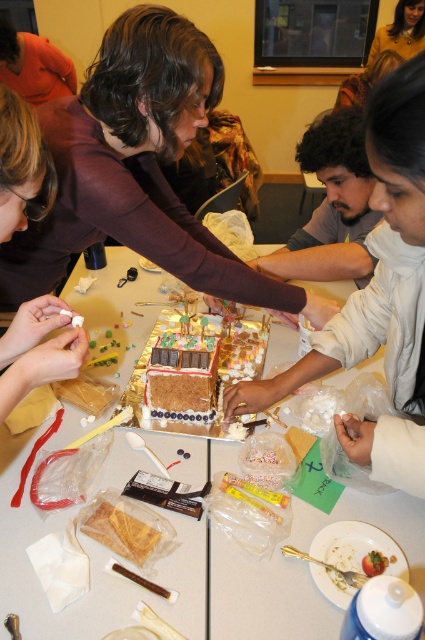
Does dark curly hair at center have a greater width compared to brown woolen sweater at upper center?

No, dark curly hair at center is not wider than brown woolen sweater at upper center.

Does dark curly hair at center have a smaller size compared to brown woolen sweater at upper center?

Actually, dark curly hair at center might be larger than brown woolen sweater at upper center.

Identify the location of dark curly hair at center. Image resolution: width=425 pixels, height=640 pixels. (331, 205).

At what (x,y) coordinates should I click in order to perform the action: click on dark curly hair at center. Please return your answer as a coordinate pair (x, y). The image size is (425, 640). Looking at the image, I should click on (331, 205).

Is matte white marshmallow at center below dark curly hair at center?

Correct, matte white marshmallow at center is located below dark curly hair at center.

In order to click on matte white marshmallow at center in this screenshot , I will do `click(37, 349)`.

Describe the element at coordinates (37, 349) in the screenshot. I see `matte white marshmallow at center` at that location.

Where is `matte white marshmallow at center`? Image resolution: width=425 pixels, height=640 pixels. matte white marshmallow at center is located at coordinates (37, 349).

Is white plastic table at center taller than candy-coated chocolate cake at center?

Yes.

Between point (3, 513) and point (172, 413), which one is positioned behind?

The point (172, 413) is behind.

Is point (113, 596) more distant than point (164, 381)?

No, (113, 596) is in front of (164, 381).

You are a GUI agent. You are given a task and a screenshot of the screen. Output one action in this format:
    pyautogui.click(x=<x>, y=<y>)
    Task: Click on the white plastic table at center
    The width and height of the screenshot is (425, 640).
    Given the screenshot: What is the action you would take?
    pyautogui.click(x=90, y=566)